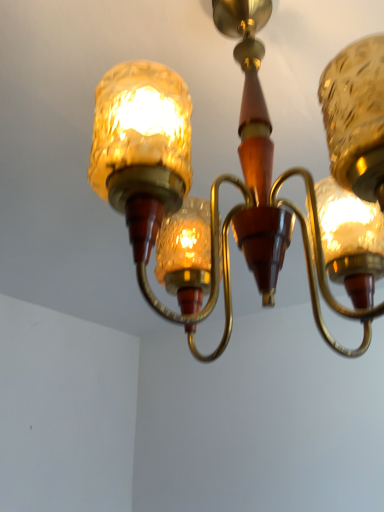
Describe the element at coordinates (213, 182) in the screenshot. I see `amber textured glass lamp at upper center` at that location.

This screenshot has height=512, width=384. I want to click on amber textured glass lamp at upper center, so click(x=213, y=182).

The width and height of the screenshot is (384, 512). What are the coordinates of `amber textured glass lamp at upper center` in the screenshot? It's located at coord(213,182).